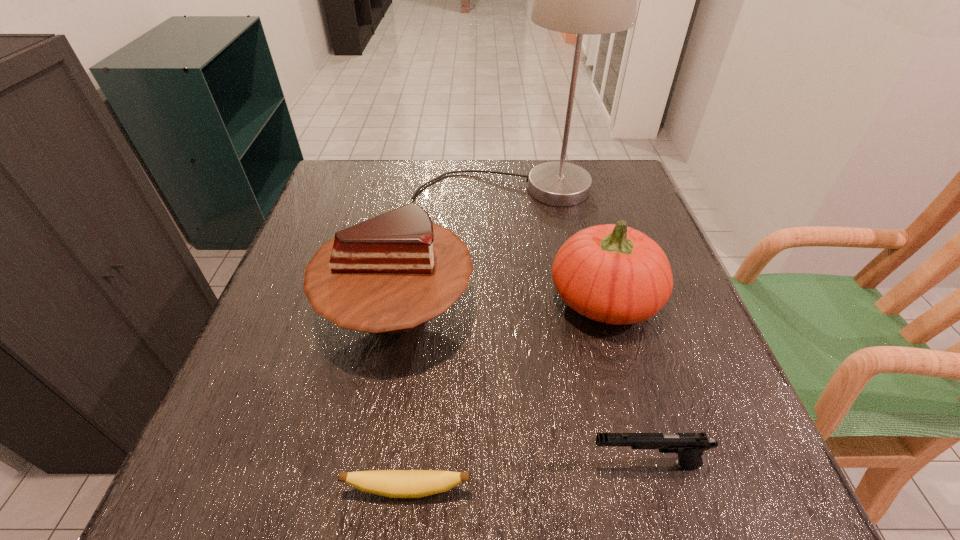
Identify the location of table lamp. (579, 0).

This screenshot has width=960, height=540. I want to click on the tallest object, so click(x=579, y=0).

At what (x,y) coordinates should I click in order to perform the action: click on cake. Please return your answer as a coordinate pair (x, y). Looking at the image, I should click on (389, 274).

Where is `pumpkin`? This screenshot has width=960, height=540. pumpkin is located at coordinates (611, 273).

Locate an element on the screen. Image resolution: width=960 pixels, height=540 pixels. the second shortest object is located at coordinates (689, 446).

The image size is (960, 540). Identify the location of the fourth farthest object. (689, 446).

Locate an element on the screen. the shortest object is located at coordinates (390, 483).

The image size is (960, 540). In order to click on the nearest object in this screenshot , I will do `click(390, 483)`.

Locate an element on the screen. free space located 0.240m on the left of the farthest object is located at coordinates (324, 189).

I want to click on free location located 0.190m on the front of the cake, so click(x=366, y=489).